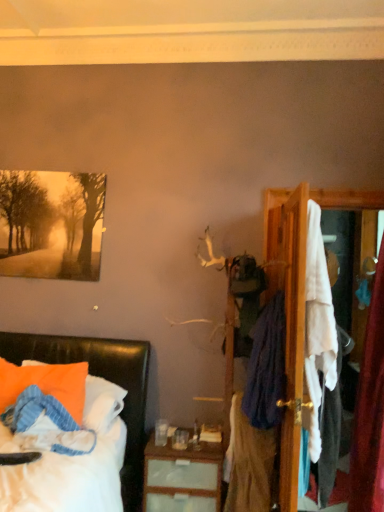
Question: From a real-world perspective, is matte black bed at lower left beneath wooden dresser at right?

Choices:
 (A) yes
 (B) no

Answer: (A)

Question: Does matte black bed at lower left have a smaller size compared to wooden dresser at right?

Choices:
 (A) yes
 (B) no

Answer: (B)

Question: Is matte black bed at lower left facing towards wooden dresser at right?

Choices:
 (A) yes
 (B) no

Answer: (B)

Question: Can you confirm if matte black bed at lower left is shorter than wooden dresser at right?

Choices:
 (A) yes
 (B) no

Answer: (A)

Question: From the image's perspective, is matte black bed at lower left located beneath wooden dresser at right?

Choices:
 (A) yes
 (B) no

Answer: (A)

Question: Is matte black bed at lower left beside wooden dresser at right?

Choices:
 (A) no
 (B) yes

Answer: (A)

Question: Is wooden dresser at right completely or partially inside orange fabric pillow at lower left?

Choices:
 (A) yes
 (B) no

Answer: (B)

Question: Is orange fabric pillow at lower left not inside wooden dresser at right?

Choices:
 (A) no
 (B) yes

Answer: (B)

Question: Does orange fabric pillow at lower left have a larger size compared to wooden dresser at right?

Choices:
 (A) no
 (B) yes

Answer: (A)

Question: Is orange fabric pillow at lower left oriented towards wooden dresser at right?

Choices:
 (A) yes
 (B) no

Answer: (B)

Question: Does orange fabric pillow at lower left have a greater height compared to wooden dresser at right?

Choices:
 (A) yes
 (B) no

Answer: (B)

Question: From a real-world perspective, is orange fabric pillow at lower left over wooden dresser at right?

Choices:
 (A) no
 (B) yes

Answer: (A)

Question: Considering the relative sizes of matte paper painting at upper left and wooden dresser at right in the image provided, is matte paper painting at upper left shorter than wooden dresser at right?

Choices:
 (A) no
 (B) yes

Answer: (B)